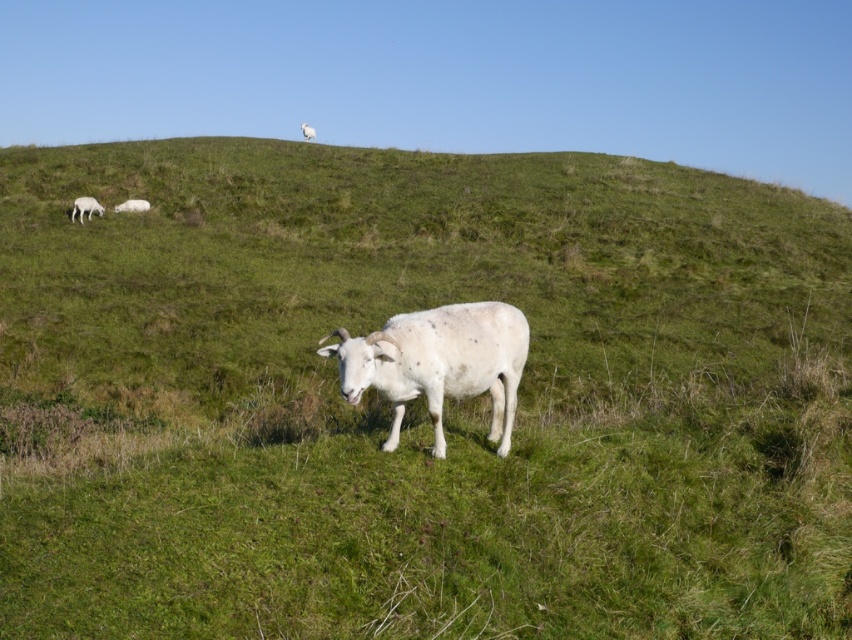
Can you confirm if white woolen goat at center is shorter than white woolly sheep at upper left?

No.

Is white woolen goat at center to the left of white woolly sheep at upper left from the viewer's perspective?

In fact, white woolen goat at center is to the right of white woolly sheep at upper left.

You are a GUI agent. You are given a task and a screenshot of the screen. Output one action in this format:
    pyautogui.click(x=<x>, y=<y>)
    Task: Click on the white woolen goat at center
    Image resolution: width=852 pixels, height=640 pixels.
    Given the screenshot: What is the action you would take?
    pyautogui.click(x=438, y=364)

Is point (125, 202) positioned before point (304, 138)?

Yes.

Between white woolly sheep at upper left and white woolly sheep at upper center, which one is positioned higher?

white woolly sheep at upper center is higher up.

Between point (121, 211) and point (306, 136), which one is positioned in front?

Point (121, 211) is more forward.

Image resolution: width=852 pixels, height=640 pixels. Find the location of `white woolly sheep at upper left`. white woolly sheep at upper left is located at coordinates (131, 205).

Who is more forward, (93, 200) or (309, 129)?

Point (93, 200) is in front.

Is white woolly sheep at left above white woolly sheep at upper center?

Incorrect, white woolly sheep at left is not positioned above white woolly sheep at upper center.

The width and height of the screenshot is (852, 640). What do you see at coordinates (85, 208) in the screenshot?
I see `white woolly sheep at left` at bounding box center [85, 208].

Image resolution: width=852 pixels, height=640 pixels. What are the coordinates of `white woolly sheep at left` in the screenshot? It's located at (85, 208).